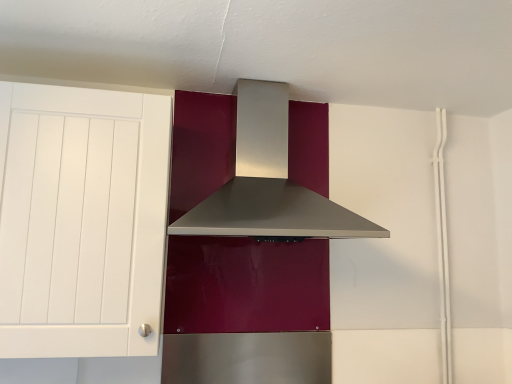
Locate an element on the screen. This screenshot has height=384, width=512. white matte cabinet at left is located at coordinates [x=81, y=220].

This screenshot has width=512, height=384. What do you see at coordinates (81, 220) in the screenshot? I see `white matte cabinet at left` at bounding box center [81, 220].

This screenshot has width=512, height=384. Identify the location of satin silver range hood at center. (268, 182).

Measure the distance between satin silver range hood at center and camera.

The depth of satin silver range hood at center is 3.53 feet.

What do you see at coordinates (268, 182) in the screenshot? I see `satin silver range hood at center` at bounding box center [268, 182].

The width and height of the screenshot is (512, 384). In order to click on white matte cabinet at left in this screenshot , I will do `click(81, 220)`.

Is white matte cabinet at left to the left of satin silver range hood at center from the viewer's perspective?

Indeed, white matte cabinet at left is positioned on the left side of satin silver range hood at center.

Does white matte cabinet at left come behind satin silver range hood at center?

That is False.

Which is closer to the camera, (136,296) or (237,190)?

Point (136,296) is closer to the camera than point (237,190).

Looking at this image, from the image's perspective, relative to satin silver range hood at center, is white matte cabinet at left above or below?

Clearly, from the image's perspective, white matte cabinet at left is below satin silver range hood at center.

In the scene shown: From a real-world perspective, is white matte cabinet at left positioned under satin silver range hood at center based on gravity?

Yes.

Which of these two, white matte cabinet at left or satin silver range hood at center, is wider?

satin silver range hood at center.

From the picture: Which of these two, white matte cabinet at left or satin silver range hood at center, stands taller?

With more height is white matte cabinet at left.

Looking at the image, does white matte cabinet at left seem bigger or smaller compared to satin silver range hood at center?

white matte cabinet at left is smaller than satin silver range hood at center.

Looking at this image, choose the correct answer: Is white matte cabinet at left inside satin silver range hood at center or outside it?

white matte cabinet at left is not inside satin silver range hood at center, it's outside.

Is there a large distance between white matte cabinet at left and satin silver range hood at center?

That's not correct — white matte cabinet at left is a little close to satin silver range hood at center.

Does white matte cabinet at left turn towards satin silver range hood at center?

No.

Image resolution: width=512 pixels, height=384 pixels. What are the coordinates of `cabinetry that is below the satin silver range hood at center (from the image's perspective)` in the screenshot? It's located at (81, 220).

Considering the positions of objects satin silver range hood at center and white matte cabinet at left in the image provided, who is more to the left, satin silver range hood at center or white matte cabinet at left?

white matte cabinet at left.

Which object is closer to the camera, satin silver range hood at center or white matte cabinet at left?

Positioned in front is white matte cabinet at left.

Is point (244, 87) farther from viewer compared to point (152, 153)?

Yes, point (244, 87) is farther from viewer.

From the picture: From the image's perspective, relative to white matte cabinet at left, is satin silver range hood at center above or below?

satin silver range hood at center is above white matte cabinet at left.

From a real-world perspective, is satin silver range hood at center on white matte cabinet at left?

Yes, from a real-world perspective, satin silver range hood at center is over white matte cabinet at left

Between satin silver range hood at center and white matte cabinet at left, which one has smaller width?

With smaller width is white matte cabinet at left.

Which of these two, satin silver range hood at center or white matte cabinet at left, stands taller?

Standing taller between the two is white matte cabinet at left.

Looking at the image, does satin silver range hood at center seem bigger or smaller compared to white matte cabinet at left?

In the image, satin silver range hood at center appears to be larger than white matte cabinet at left.

Is satin silver range hood at center located outside white matte cabinet at left?

Indeed, satin silver range hood at center is completely outside white matte cabinet at left.

Is satin silver range hood at center touching white matte cabinet at left?

No, satin silver range hood at center is not next to white matte cabinet at left.

Is white matte cabinet at left at the back of satin silver range hood at center?

No, satin silver range hood at center's orientation is not away from white matte cabinet at left.

What's the angular difference between satin silver range hood at center and white matte cabinet at left's facing directions?

The angular difference between satin silver range hood at center and white matte cabinet at left is 1.49 degrees.

Image resolution: width=512 pixels, height=384 pixels. Identify the location of home appliance located on the right of white matte cabinet at left. (268, 182).

Identify the location of cabinetry lying in front of the satin silver range hood at center. This screenshot has width=512, height=384. (81, 220).

This screenshot has width=512, height=384. I want to click on cabinetry below the satin silver range hood at center (from the image's perspective), so click(81, 220).